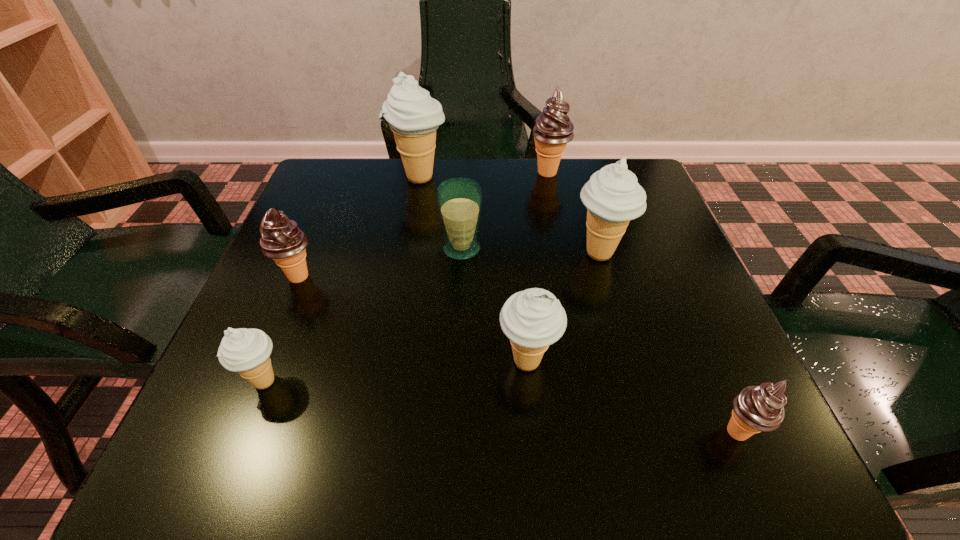
Identify the location of free point between the second beige icecream from right to left and the glass. The width and height of the screenshot is (960, 540). (494, 306).

Where is `free spot between the leftmost beige icecream and the farthest chocolate icecream`? free spot between the leftmost beige icecream and the farthest chocolate icecream is located at coordinates (406, 276).

The width and height of the screenshot is (960, 540). What are the coordinates of `vacant area between the third smallest beige icecream and the second biggest chocolate icecream` in the screenshot? It's located at (449, 265).

This screenshot has height=540, width=960. I want to click on vacant area between the second chocolate icecream from right to left and the second farthest beige icecream, so click(x=574, y=213).

Find the location of a particular element. empty location between the second beige icecream from right to left and the second nearest chocolate icecream is located at coordinates (413, 320).

Find the location of `empty space that is in between the second biggest beige icecream and the farthest chocolate icecream`. empty space that is in between the second biggest beige icecream and the farthest chocolate icecream is located at coordinates (574, 213).

Find the location of a particular element. This screenshot has height=540, width=960. free space between the rightmost icecream and the second biggest beige icecream is located at coordinates (669, 343).

Identify the location of object that ranks as the sixth closest to the farthest beige icecream. This screenshot has height=540, width=960. (246, 351).

Locate which object ranks sixth in proximity to the blue glass. Please provide its 2D coordinates. Your answer should be formatted as a tuple, i.e. [(x, y)], where the tuple contains the x and y coordinates of a point satisfying the conditions above.

[(246, 351)]

Select which icecream is the sixth closest to the second farthest chocolate icecream. Please provide its 2D coordinates. Your answer should be formatted as a tuple, i.e. [(x, y)], where the tuple contains the x and y coordinates of a point satisfying the conditions above.

[(760, 408)]